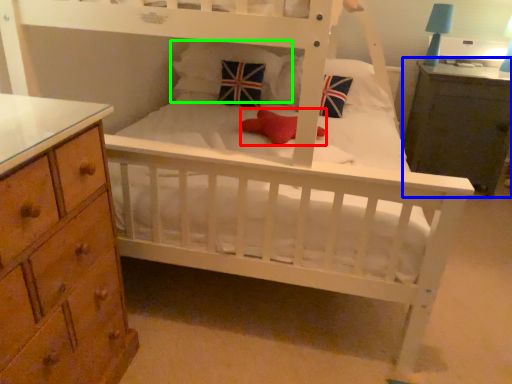
Question: Based on their relative distances, which object is farther from toy (highlighted by a red box)? Choose from nightstand (highlighted by a blue box) and pillow (highlighted by a green box).

Choices:
 (A) nightstand
 (B) pillow

Answer: (A)